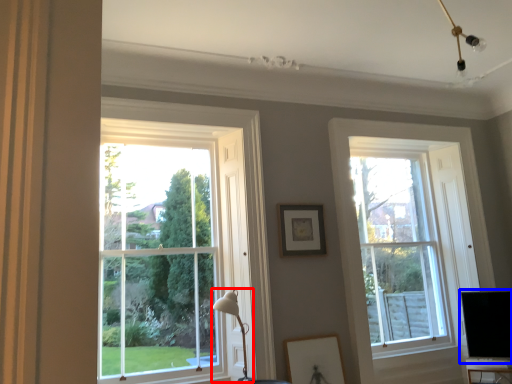
Question: Which of the following is the farthest to the observer, table lamp (highlighted by a red box) or computer monitor (highlighted by a blue box)?

Choices:
 (A) table lamp
 (B) computer monitor

Answer: (B)